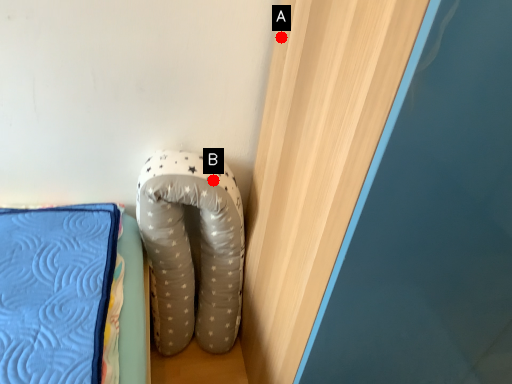
Question: Two points are circled on the image, labeled by A and B beside each circle. Which of the following is the farthest from the observer?

Choices:
 (A) A is further
 (B) B is further

Answer: (B)